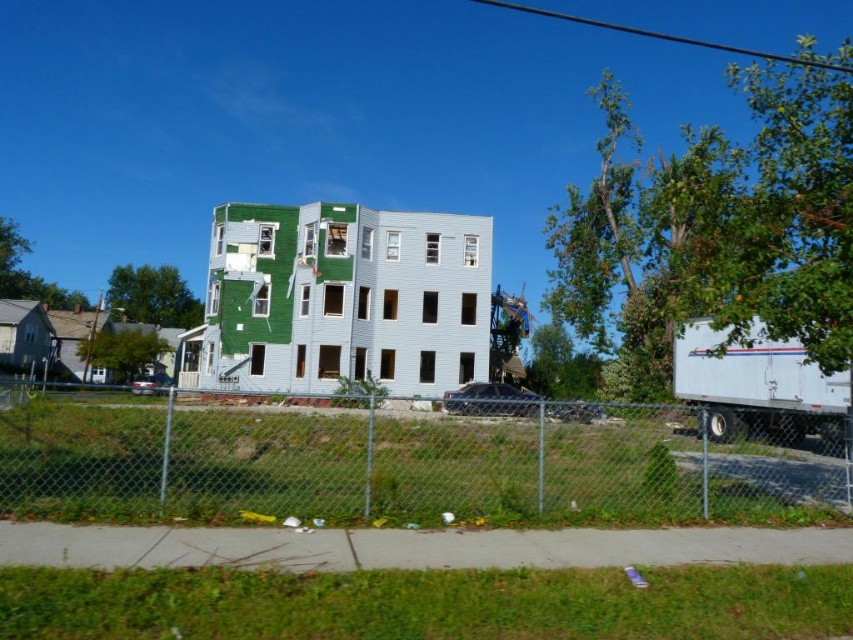
You are a delivery driver who needs to park your white matte trailer truck at right closer to the green matte building at center. Given their sizes, will the truck fit within the space between the building and the fence?

The green matte building at center is larger in size than the white matte trailer truck at right, so the truck should fit within the space between the building and the fence as long as there is enough clearance.

You are standing outside the chain link fence looking at the green matte building at center and the white matte trailer truck at right. Which object is closer to you?

The green matte building at center is closer to you because the white matte trailer truck at right is behind it.